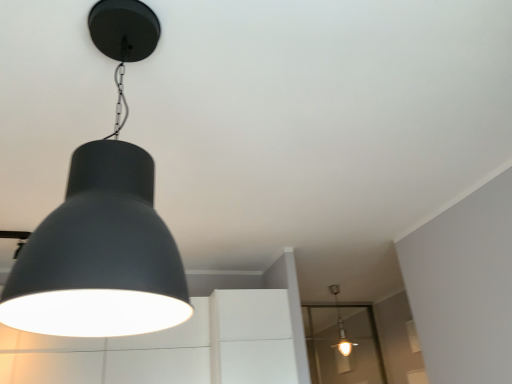
Question: Is point (137, 261) positioned closer to the camera than point (335, 296)?

Choices:
 (A) farther
 (B) closer

Answer: (B)

Question: Is matte black lampshade at upper left, the second lamp ordered from the bottom, in front of or behind matte white bulb at center, which is counted as the first lamp, starting from the back, in the image?

Choices:
 (A) behind
 (B) front

Answer: (B)

Question: Which of these objects is positioned farthest from the transparent glass door at lower right?

Choices:
 (A) matte black lampshade at upper left, which is the 2th lamp in right-to-left order
 (B) matte white bulb at center, which is counted as the first lamp, starting from the back

Answer: (A)

Question: Which object is positioned closest to the matte white bulb at center, which is counted as the first lamp, starting from the back?

Choices:
 (A) transparent glass door at lower right
 (B) matte black lampshade at upper left, which is the 2th lamp in right-to-left order

Answer: (A)